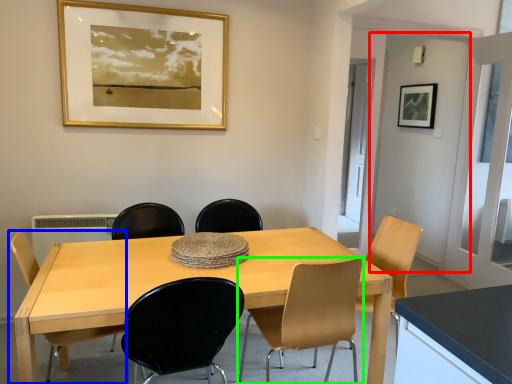
Question: Based on their relative distances, which object is farther from door (highlighted by a red box)? Choose from chair (highlighted by a blue box) and chair (highlighted by a green box).

Choices:
 (A) chair
 (B) chair

Answer: (A)